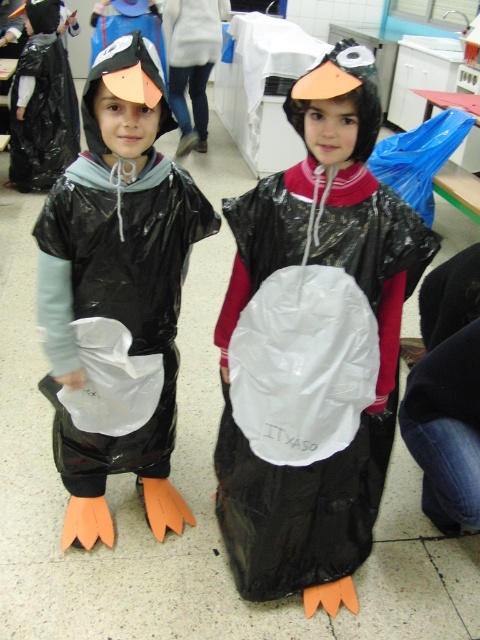
Does point (37, 244) lie in front of point (359, 221)?

No, (37, 244) is behind (359, 221).

Between matte black penguin costume at center and matte black penguin at center, which one is positioned higher?

Positioned higher is matte black penguin costume at center.

Identify the location of matte black penguin costume at center. This screenshot has width=480, height=640. (117, 294).

Find the location of `matte black penguin costume at center`. matte black penguin costume at center is located at coordinates (117, 294).